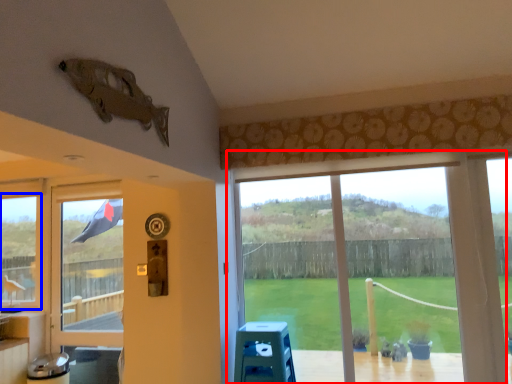
Question: Which object appears farthest to the camera in this image, window (highlighted by a red box) or window (highlighted by a blue box)?

Choices:
 (A) window
 (B) window

Answer: (B)